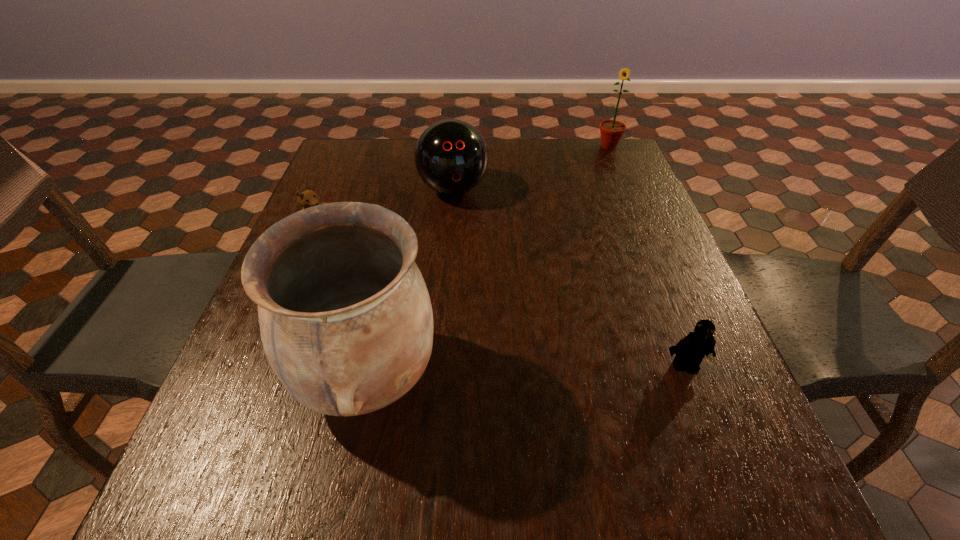
Find the location of `blank space at the right edge of the desktop`. blank space at the right edge of the desktop is located at coordinates (605, 252).

You are a GUI agent. You are given a task and a screenshot of the screen. Output one action in this format:
    pyautogui.click(x=<x>, y=<y>)
    Task: Click on the free space at the far left corner of the desktop
    Image resolution: width=960 pixels, height=540 pixels.
    Given the screenshot: What is the action you would take?
    pyautogui.click(x=329, y=160)

This screenshot has width=960, height=540. In the image, there is a desktop. Find the location of `free space at the near right corner`. free space at the near right corner is located at coordinates (750, 417).

The image size is (960, 540). In order to click on free space between the urn and the farthest object in this screenshot , I will do `click(489, 261)`.

I want to click on unoccupied position between the Lego and the tallest object, so click(x=526, y=370).

Where is `unoccupied area between the third shortest object and the Lego`? unoccupied area between the third shortest object and the Lego is located at coordinates (569, 277).

Where is `empty space between the Lego and the sunflower`? This screenshot has height=540, width=960. empty space between the Lego and the sunflower is located at coordinates (647, 255).

Identify the location of free space between the Lego and the urn. The image size is (960, 540). (526, 370).

Locate an element on the screen. The height and width of the screenshot is (540, 960). the third closest object to the tallest object is located at coordinates (690, 350).

What are the coordinates of `the closest object to the second farthest object` in the screenshot? It's located at (308, 198).